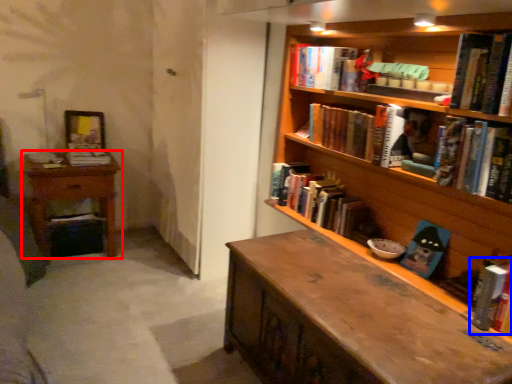
Question: Which of the following is the farthest to the observer, nightstand (highlighted by a red box) or book (highlighted by a blue box)?

Choices:
 (A) nightstand
 (B) book

Answer: (A)